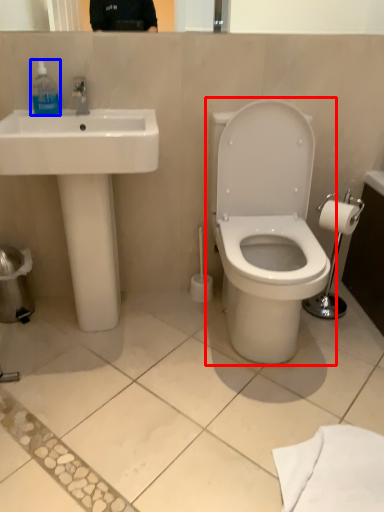
Question: Which object appears closest to the camera in this image, toilet (highlighted by a red box) or toiletry (highlighted by a blue box)?

Choices:
 (A) toilet
 (B) toiletry

Answer: (A)